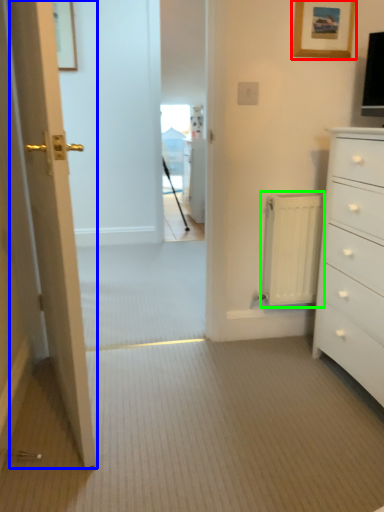
Question: Which is farther away from picture frame (highlighted by a red box)? door (highlighted by a blue box) or radiator (highlighted by a green box)?

Choices:
 (A) door
 (B) radiator

Answer: (A)